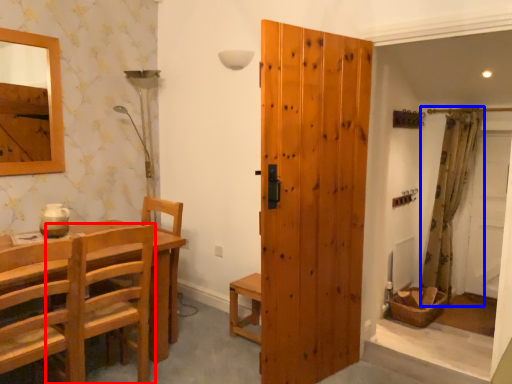
Question: Which of the following is the farthest to the observer, chair (highlighted by a red box) or curtain (highlighted by a blue box)?

Choices:
 (A) chair
 (B) curtain

Answer: (B)